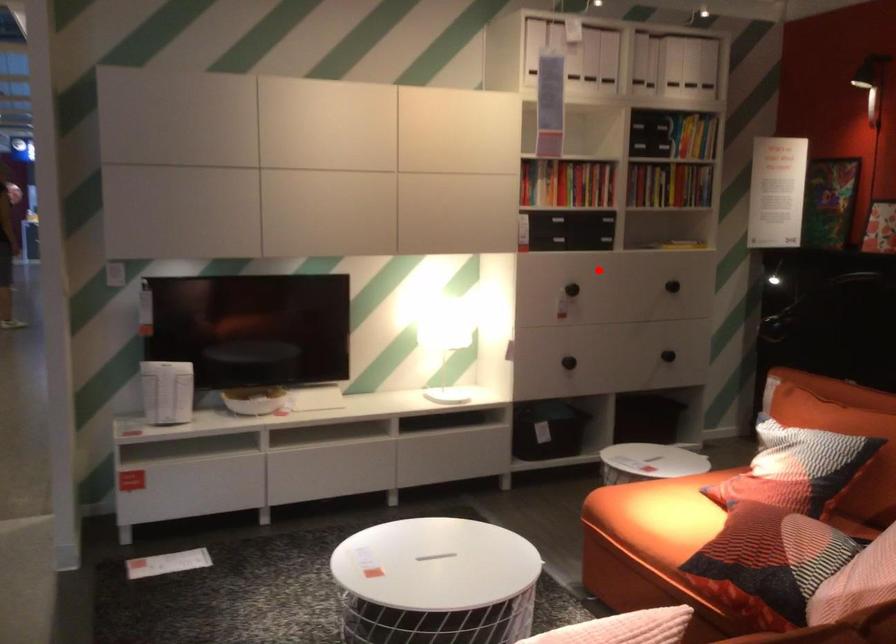
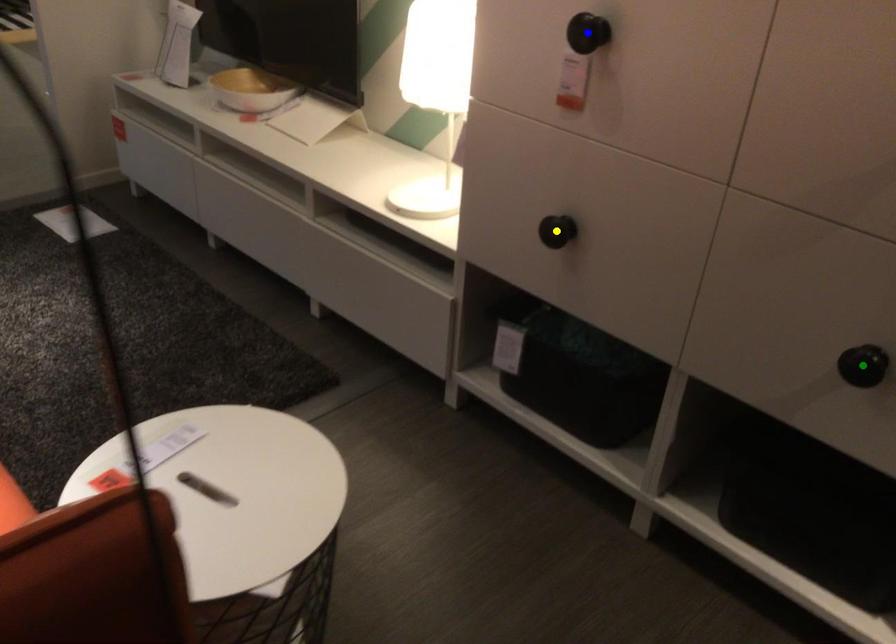
Question: I am providing you with two images of the same scene from different viewpoints. A red point is marked on the first image. You are given multiple points on the second image. Which point in image 2 is actually the same real-world point as the red point in image 1?

Choices:
 (A) green point
 (B) yellow point
 (C) blue point

Answer: (C)